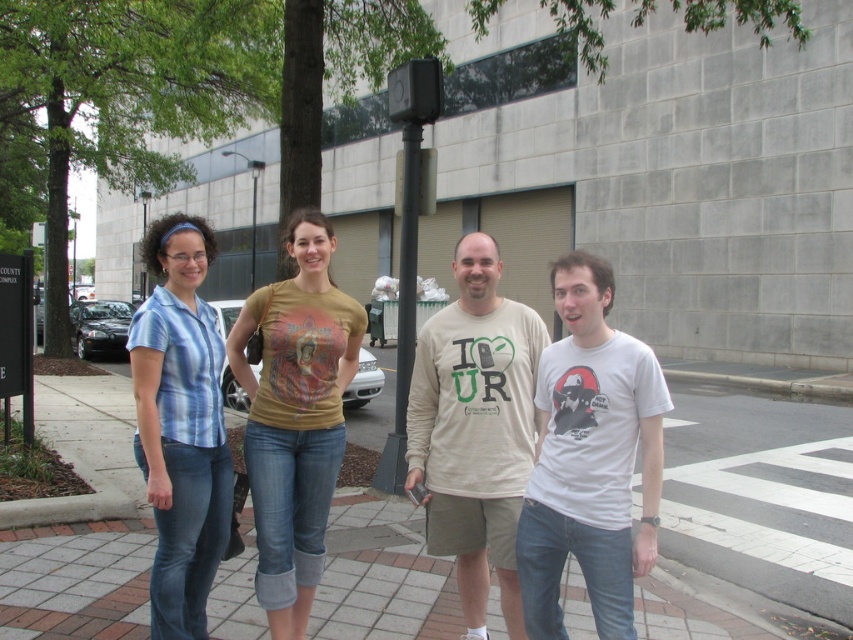
Question: Can you confirm if brick pavement at center is bigger than blue striped shirt at left?

Choices:
 (A) no
 (B) yes

Answer: (B)

Question: Can you confirm if white cotton t-shirt at center is positioned below matte yellow t-shirt at center?

Choices:
 (A) yes
 (B) no

Answer: (A)

Question: Among these points, which one is nearest to the camera?

Choices:
 (A) (496, 637)
 (B) (453, 416)
 (C) (558, 563)

Answer: (C)

Question: Is brick pavement at center to the right of beige cotton shirt at center from the viewer's perspective?

Choices:
 (A) no
 (B) yes

Answer: (A)

Question: Which of the following is the closest to the observer?

Choices:
 (A) (560, 288)
 (B) (750, 445)

Answer: (A)

Question: Considering the real-world distances, which object is closest to the blue striped shirt at left?

Choices:
 (A) beige cotton shirt at center
 (B) brick pavement at lower center
 (C) brick pavement at center

Answer: (B)